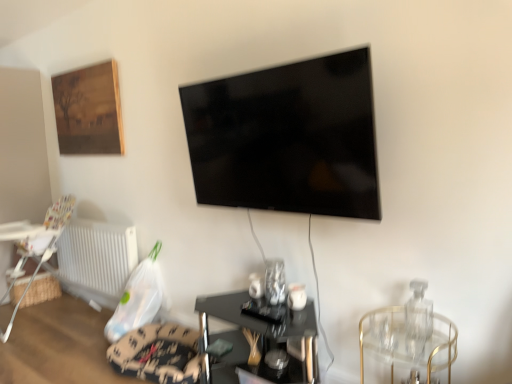
Question: In the image, is white plastic highchair at lower left on the left side or the right side of clear glass table at right?

Choices:
 (A) left
 (B) right

Answer: (A)

Question: In terms of height, does white plastic highchair at lower left look taller or shorter compared to clear glass table at right?

Choices:
 (A) short
 (B) tall

Answer: (B)

Question: Which of these objects is positioned closest to the white plastic highchair at lower left?

Choices:
 (A) black glossy tv at upper center
 (B) woven wood table at left, the 1th table in the back-to-front sequence
 (C) black glass table at center, which is the 2th table from back to front
 (D) white plastic radiator at lower left
 (E) wooden framed painting at upper left

Answer: (B)

Question: Estimate the real-world distances between objects in this image. Which object is farther from the black glass table at center, the 1th table viewed from the front?

Choices:
 (A) wooden framed painting at upper left
 (B) white plastic highchair at lower left
 (C) velvet-like beige swivel chair at lower center
 (D) clear glass table at right
 (E) white plastic radiator at lower left

Answer: (B)